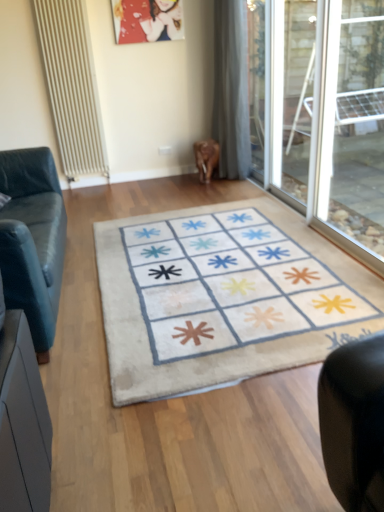
The image size is (384, 512). Describe the element at coordinates (346, 143) in the screenshot. I see `transparent glass window at right` at that location.

Based on the photo, measure the distance between leather couch at left and camera.

A distance of 1.85 meters exists between leather couch at left and camera.

Find the location of a particular element. The image size is (384, 512). transparent glass window at right is located at coordinates (346, 143).

From the image's perspective, is beige textured radiator at left located above or below beige fabric doormat at center?

beige textured radiator at left is situated higher than beige fabric doormat at center in the image.

Is beige textured radiator at left turned away from beige fabric doormat at center?

No, beige fabric doormat at center is not at the back of beige textured radiator at left.

Is beige textured radiator at left smaller than gray fabric curtain at center?

Indeed, beige textured radiator at left has a smaller size compared to gray fabric curtain at center.

Considering the points (89, 158) and (244, 125), which point is in front, point (89, 158) or point (244, 125)?

The point (244, 125) is closer.

Does beige textured radiator at left contain gray fabric curtain at center?

Definitely not — gray fabric curtain at center is not inside beige textured radiator at left.

Is beige textured radiator at left next to gray fabric curtain at center?

No, beige textured radiator at left is not next to gray fabric curtain at center.

Is gray fabric curtain at center next to beige textured radiator at left?

No, gray fabric curtain at center is not touching beige textured radiator at left.

Is gray fabric curtain at center at the left side of beige textured radiator at left?

No, gray fabric curtain at center is not to the left of beige textured radiator at left.

Considering the relative sizes of gray fabric curtain at center and beige textured radiator at left in the image provided, is gray fabric curtain at center wider than beige textured radiator at left?

Indeed, gray fabric curtain at center has a greater width compared to beige textured radiator at left.

The image size is (384, 512). I want to click on radiator behind the gray fabric curtain at center, so click(71, 86).

Is leather couch at left shorter than matte plastic picture frame at upper center?

In fact, leather couch at left may be taller than matte plastic picture frame at upper center.

Is leather couch at left inside or outside of matte plastic picture frame at upper center?

The correct answer is: outside.

Between leather couch at left and matte plastic picture frame at upper center, which one has larger size?

leather couch at left.

In terms of size, does transparent glass window at right appear bigger or smaller than beige textured radiator at left?

Considering their sizes, transparent glass window at right takes up more space than beige textured radiator at left.

Which of these two, transparent glass window at right or beige textured radiator at left, stands taller?

Standing taller between the two is beige textured radiator at left.

Can you tell me how much transparent glass window at right and beige textured radiator at left differ in facing direction?

The angular difference between transparent glass window at right and beige textured radiator at left is 90.1 degrees.

Is the depth of gray fabric curtain at center greater than that of transparent glass window at right?

Yes, it is behind transparent glass window at right.

How much distance is there between gray fabric curtain at center and transparent glass window at right?

They are 1.30 meters apart.

The width and height of the screenshot is (384, 512). I want to click on window below the gray fabric curtain at center (from a real-world perspective), so click(346, 143).

Does gray fabric curtain at center appear on the left side of transparent glass window at right?

Correct, you'll find gray fabric curtain at center to the left of transparent glass window at right.

What are the coordinates of `window above the beige fabric doormat at center (from a real-world perspective)` in the screenshot? It's located at (346, 143).

Is beige fabric doormat at center to the left of transparent glass window at right from the viewer's perspective?

Correct, you'll find beige fabric doormat at center to the left of transparent glass window at right.

Is beige fabric doormat at center thinner than transparent glass window at right?

Incorrect, the width of beige fabric doormat at center is not less than that of transparent glass window at right.

In the image, there is a beige fabric doormat at center. Where is `radiator above it (from the image's perspective)`? The image size is (384, 512). radiator above it (from the image's perspective) is located at coordinates (71, 86).

You are a GUI agent. You are given a task and a screenshot of the screen. Output one action in this format:
    pyautogui.click(x=<x>, y=<y>)
    Task: Click on the curtain below the beige textured radiator at left (from a real-world perspective)
    
    Given the screenshot: What is the action you would take?
    pyautogui.click(x=231, y=89)

Looking at the image, which one is located closer to beige textured radiator at left, transparent glass window at right or leather couch at left?

leather couch at left is positioned closer to the anchor beige textured radiator at left.

Based on their spatial positions, is leather couch at left or beige fabric doormat at center closer to matte plastic picture frame at upper center?

leather couch at left is positioned closer to the anchor matte plastic picture frame at upper center.

Based on the photo, based on their spatial positions, is beige fabric doormat at center or leather couch at left closer to beige textured radiator at left?

Among the two, leather couch at left is located nearer to beige textured radiator at left.

Looking at the image, which one is located further to matte plastic picture frame at upper center, transparent glass window at right or leather couch at left?

leather couch at left is positioned further to the anchor matte plastic picture frame at upper center.

When comparing their distances from leather couch at left, does beige textured radiator at left or transparent glass window at right seem further?

Based on the image, transparent glass window at right appears to be further to leather couch at left.

Considering their positions, is matte plastic picture frame at upper center positioned closer to leather couch at left than gray fabric curtain at center?

gray fabric curtain at center is positioned closer to the anchor leather couch at left.

When comparing their distances from gray fabric curtain at center, does transparent glass window at right or matte plastic picture frame at upper center seem further?

transparent glass window at right is further to gray fabric curtain at center.

Considering their positions, is leather couch at left positioned further to beige fabric doormat at center than beige textured radiator at left?

beige textured radiator at left is positioned further to the anchor beige fabric doormat at center.

You are a GUI agent. You are given a task and a screenshot of the screen. Output one action in this format:
    pyautogui.click(x=<x>, y=<y>)
    Task: Click on the window between beige fabric doormat at center and beige textured radiator at left from front to back
    Image resolution: width=384 pixels, height=512 pixels.
    Given the screenshot: What is the action you would take?
    pyautogui.click(x=346, y=143)

In order to click on curtain between beige fabric doormat at center and beige textured radiator at left along the z-axis in this screenshot , I will do `click(231, 89)`.

This screenshot has height=512, width=384. I want to click on radiator between leather couch at left and matte plastic picture frame at upper center along the z-axis, so click(x=71, y=86).

Where is `doormat located between leather couch at left and matte plastic picture frame at upper center in the depth direction`? Image resolution: width=384 pixels, height=512 pixels. doormat located between leather couch at left and matte plastic picture frame at upper center in the depth direction is located at coordinates (222, 298).